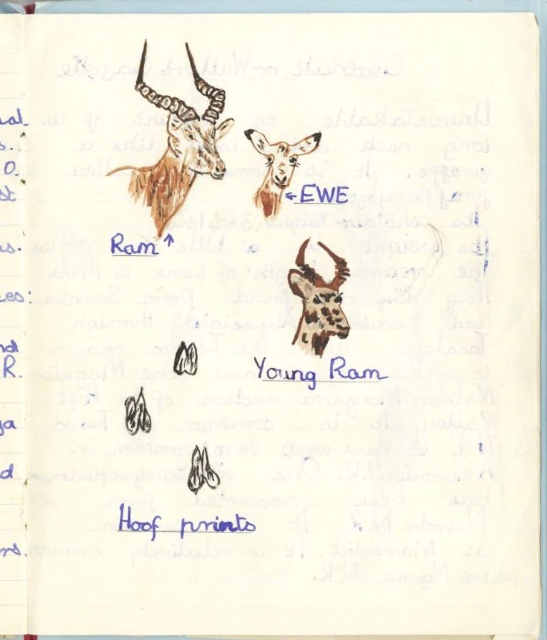
You are looking at a hand drawn illustration on lined notebook paper. You see a brown textured ram at upper left and a brown textured head at upper center. Which one is closer to you?

The brown textured ram at upper left is closer to you because it is in front of the brown textured head at upper center.

You are an art student analyzing the notebook drawing. You need to determine the spatial relationship between the speckled fur young ram at center and the brown textured head at upper center. Based on the drawing, which object is positioned to the right of the other?

The speckled fur young ram at center is to the right of the brown textured head at upper center.

You are looking at a hand drawn illustration on lined notebook paper. You see a brown textured ram at upper left and a brown textured head at upper center. Which one is closer to the top edge of the paper?

The brown textured ram at upper left is positioned over the brown textured head at upper center, so it is closer to the top edge of the paper.